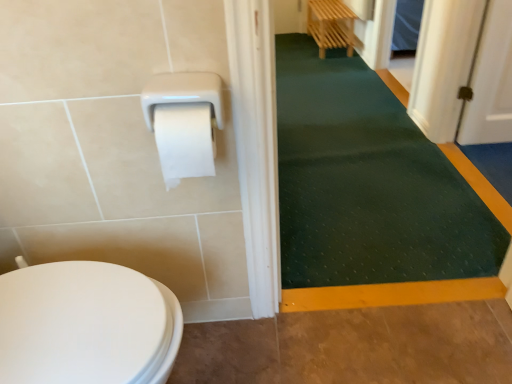
Question: Is dark green rubber bath mat at center at the right side of brown textured floor at lower right?

Choices:
 (A) no
 (B) yes

Answer: (B)

Question: Is dark green rubber bath mat at center smaller than brown textured floor at lower right?

Choices:
 (A) no
 (B) yes

Answer: (A)

Question: Is dark green rubber bath mat at center positioned with its back to brown textured floor at lower right?

Choices:
 (A) yes
 (B) no

Answer: (B)

Question: Is there a large distance between dark green rubber bath mat at center and brown textured floor at lower right?

Choices:
 (A) yes
 (B) no

Answer: (B)

Question: Considering the relative sizes of dark green rubber bath mat at center and brown textured floor at lower right in the image provided, is dark green rubber bath mat at center shorter than brown textured floor at lower right?

Choices:
 (A) yes
 (B) no

Answer: (B)

Question: From the image's perspective, would you say dark green rubber bath mat at center is positioned over brown textured floor at lower right?

Choices:
 (A) no
 (B) yes

Answer: (B)

Question: Is brown textured floor at lower right wider than dark green rubber bath mat at center?

Choices:
 (A) no
 (B) yes

Answer: (A)

Question: Is brown textured floor at lower right outside dark green rubber bath mat at center?

Choices:
 (A) no
 (B) yes

Answer: (B)

Question: Does brown textured floor at lower right appear on the left side of dark green rubber bath mat at center?

Choices:
 (A) yes
 (B) no

Answer: (A)

Question: Is brown textured floor at lower right taller than dark green rubber bath mat at center?

Choices:
 (A) no
 (B) yes

Answer: (A)

Question: From a real-world perspective, is brown textured floor at lower right positioned over dark green rubber bath mat at center based on gravity?

Choices:
 (A) yes
 (B) no

Answer: (B)

Question: Is there a large distance between brown textured floor at lower right and dark green rubber bath mat at center?

Choices:
 (A) yes
 (B) no

Answer: (B)

Question: Is brown textured floor at lower right taller or shorter than dark green rubber bath mat at center?

Choices:
 (A) tall
 (B) short

Answer: (B)